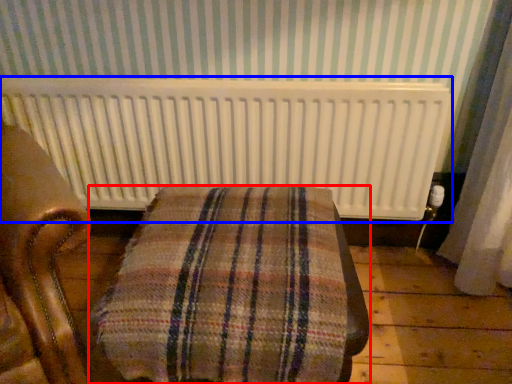
Question: Which of the following is the farthest to the observer, furniture (highlighted by a red box) or radiator (highlighted by a blue box)?

Choices:
 (A) furniture
 (B) radiator

Answer: (B)